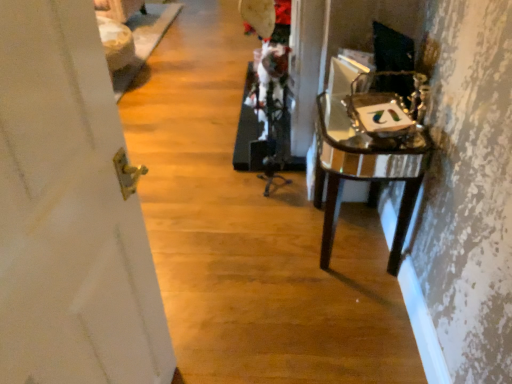
Where is `vacant location below glossy glass table at right (from a real-world perspective)`? This screenshot has width=512, height=384. vacant location below glossy glass table at right (from a real-world perspective) is located at coordinates (349, 242).